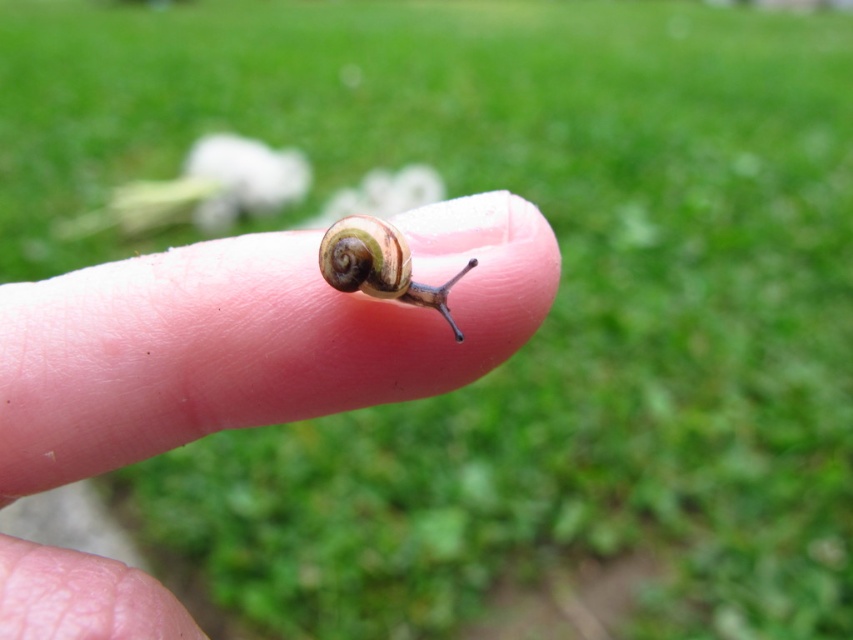
Question: Which object appears farthest from the camera in this image?

Choices:
 (A) shiny brown snail at center
 (B) pink flesh at center

Answer: (A)

Question: Which of the following is the farthest from the observer?

Choices:
 (A) (445, 378)
 (B) (341, 273)

Answer: (A)

Question: Does pink flesh at center have a larger size compared to shiny brown snail at center?

Choices:
 (A) no
 (B) yes

Answer: (B)

Question: Is the position of pink flesh at center more distant than that of shiny brown snail at center?

Choices:
 (A) no
 (B) yes

Answer: (A)

Question: Is pink flesh at center positioned at the back of shiny brown snail at center?

Choices:
 (A) yes
 (B) no

Answer: (B)